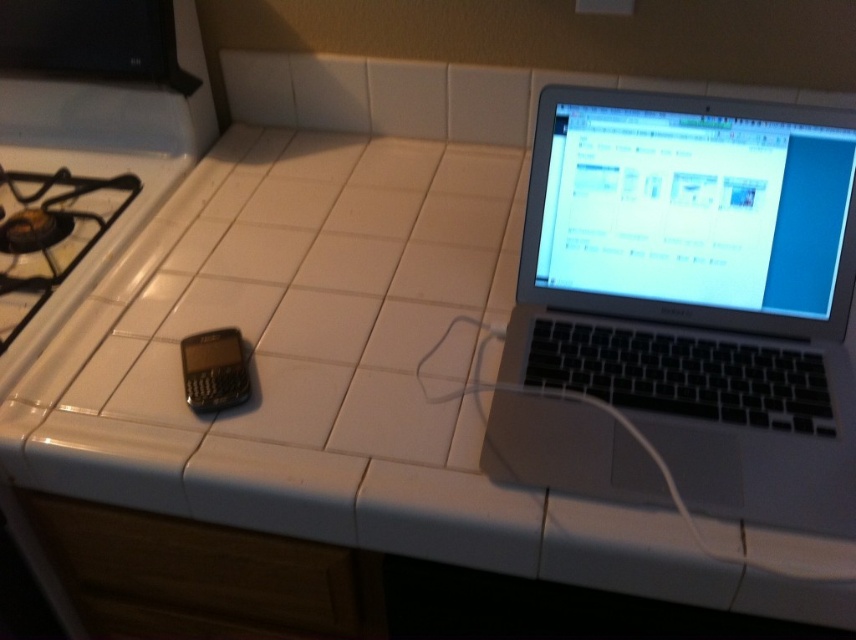
You are standing in front of the kitchen countertop and want to place a small object on the point closer to you. Which point should you choose between point (599, 148) and point (239, 353)?

Point (599, 148) is closer to the viewer, so you should place the small object on point 0.234, 0.280.